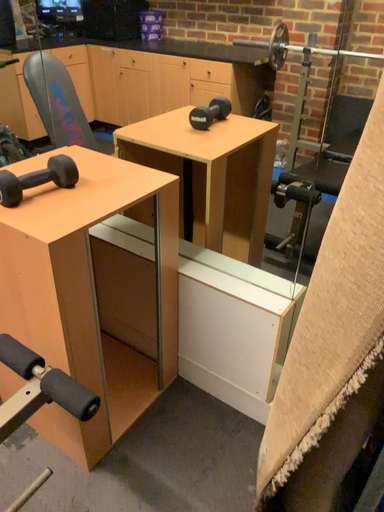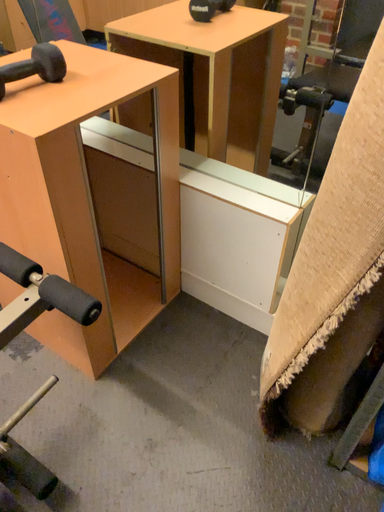
Question: How did the camera likely rotate when shooting the video?

Choices:
 (A) rotated downward
 (B) rotated upward

Answer: (A)